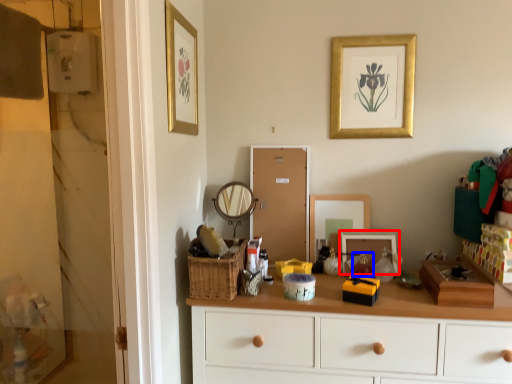
Question: Which object appears closest to the camera in this image, picture frame (highlighted by a red box) or toy (highlighted by a blue box)?

Choices:
 (A) picture frame
 (B) toy

Answer: (B)